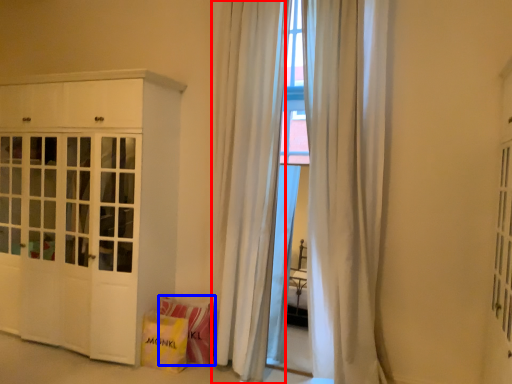
Question: Which object appears closest to the camera in this image, curtain (highlighted by a red box) or shopping bag (highlighted by a blue box)?

Choices:
 (A) curtain
 (B) shopping bag

Answer: (A)